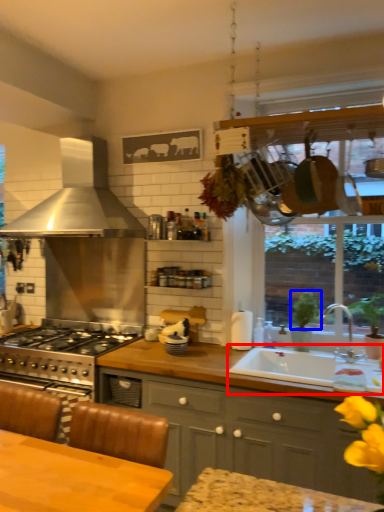
Question: Which point is further to the camera, sink (highlighted by a red box) or plant (highlighted by a blue box)?

Choices:
 (A) sink
 (B) plant

Answer: (B)